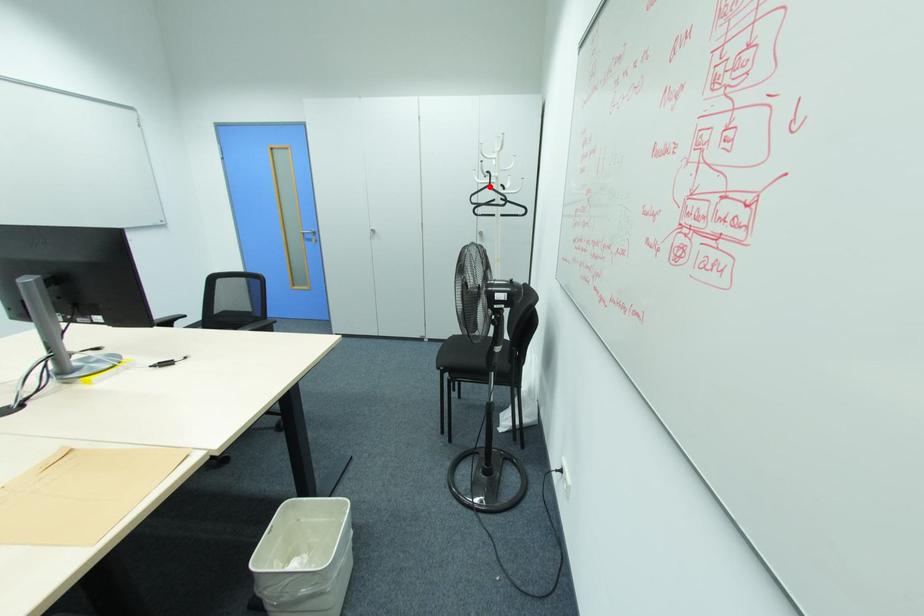
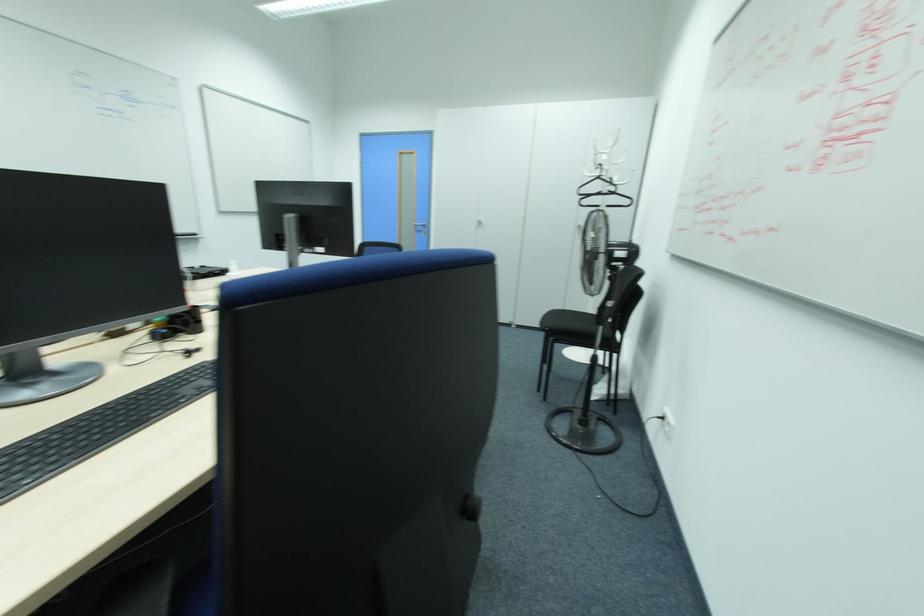
Where in the second image is the point corresponding to the highlighted location from the first image?

(599, 177)